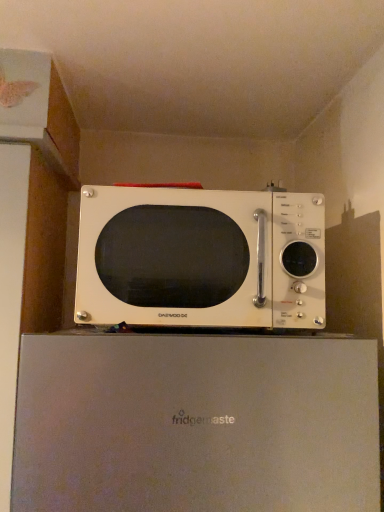
Describe the element at coordinates (200, 258) in the screenshot. I see `white glossy microwave at center` at that location.

Where is `white glossy microwave at center`? Image resolution: width=384 pixels, height=512 pixels. white glossy microwave at center is located at coordinates (200, 258).

Locate an element on the screen. white glossy microwave at center is located at coordinates (200, 258).